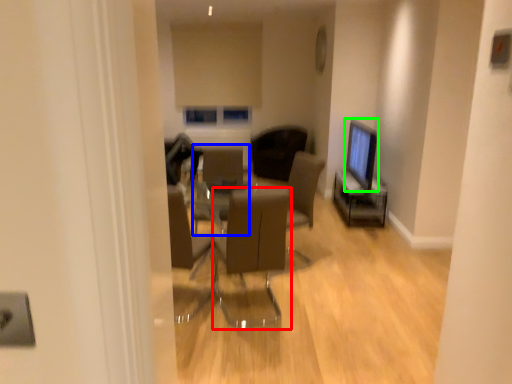
Question: Based on their relative distances, which object is nearer to chair (highlighted by a red box)? Choose from armchair (highlighted by a blue box) and computer monitor (highlighted by a green box).

Choices:
 (A) armchair
 (B) computer monitor

Answer: (A)